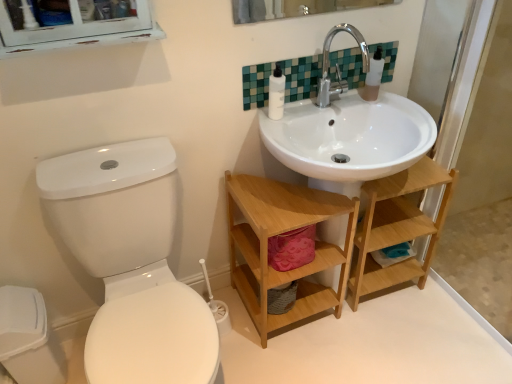
Question: Considering the relative sizes of transparent plastic soap dispenser at upper right and green mosaic tile at upper center in the image provided, is transparent plastic soap dispenser at upper right smaller than green mosaic tile at upper center?

Choices:
 (A) yes
 (B) no

Answer: (A)

Question: Would you say transparent plastic soap dispenser at upper right contains green mosaic tile at upper center?

Choices:
 (A) no
 (B) yes

Answer: (A)

Question: From the image's perspective, is transparent plastic soap dispenser at upper right below green mosaic tile at upper center?

Choices:
 (A) no
 (B) yes

Answer: (A)

Question: Does transparent plastic soap dispenser at upper right have a lesser height compared to green mosaic tile at upper center?

Choices:
 (A) no
 (B) yes

Answer: (A)

Question: From the image's perspective, is transparent plastic soap dispenser at upper right located above green mosaic tile at upper center?

Choices:
 (A) no
 (B) yes

Answer: (B)

Question: Is transparent plastic soap dispenser at upper right closer to the viewer compared to green mosaic tile at upper center?

Choices:
 (A) yes
 (B) no

Answer: (B)

Question: Is silver metallic faucet at upper center smaller than white plastic bottle at upper center?

Choices:
 (A) yes
 (B) no

Answer: (B)

Question: Is white plastic bottle at upper center at the back of silver metallic faucet at upper center?

Choices:
 (A) no
 (B) yes

Answer: (A)

Question: Is silver metallic faucet at upper center at the left side of white plastic bottle at upper center?

Choices:
 (A) no
 (B) yes

Answer: (A)

Question: Considering the relative sizes of silver metallic faucet at upper center and white plastic bottle at upper center in the image provided, is silver metallic faucet at upper center wider than white plastic bottle at upper center?

Choices:
 (A) no
 (B) yes

Answer: (B)

Question: Could you tell me if silver metallic faucet at upper center is facing white plastic bottle at upper center?

Choices:
 (A) no
 (B) yes

Answer: (A)

Question: Can you confirm if silver metallic faucet at upper center is thinner than white plastic bottle at upper center?

Choices:
 (A) no
 (B) yes

Answer: (A)

Question: Is silver metallic faucet at upper center smaller than transparent plastic soap dispenser at upper right?

Choices:
 (A) no
 (B) yes

Answer: (A)